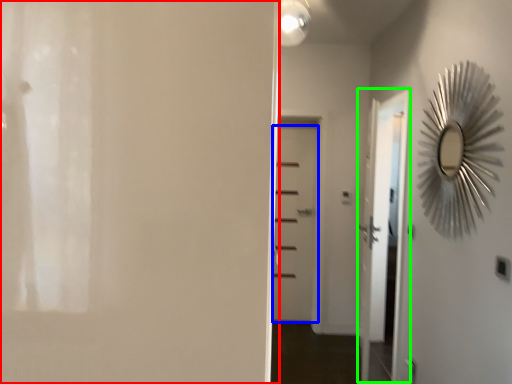
Question: Based on their relative distances, which object is nearer to door (highlighted by a red box)? Choose from door (highlighted by a blue box) and screen door (highlighted by a green box).

Choices:
 (A) door
 (B) screen door

Answer: (B)